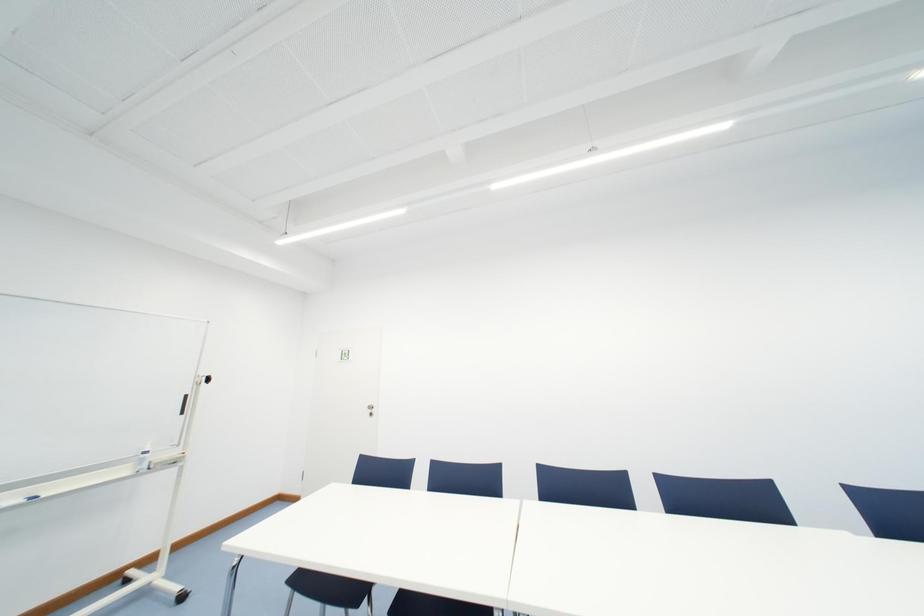
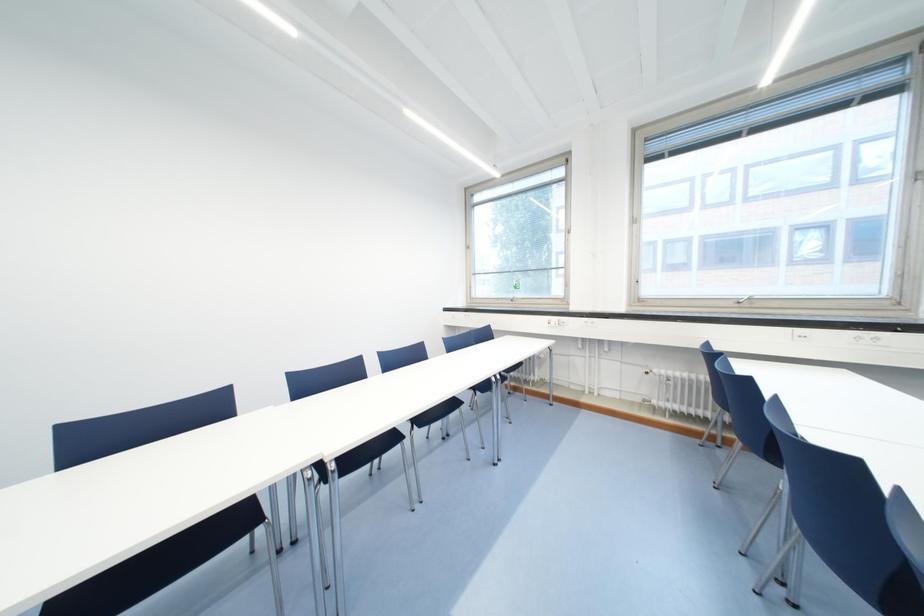
Question: The camera is either moving clockwise (left) or counter-clockwise (right) around the object. The first image is from the beginning of the video and the second image is from the end. Is the camera moving left or right when shooting the video?

Choices:
 (A) Left
 (B) Right

Answer: (A)